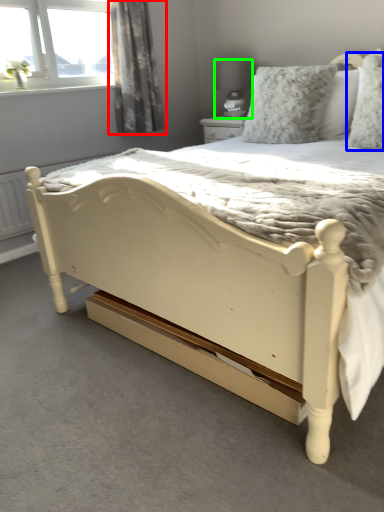
Question: Based on their relative distances, which object is farther from curtain (highlighted by a red box)? Choose from pillow (highlighted by a blue box) and lamp (highlighted by a green box).

Choices:
 (A) pillow
 (B) lamp

Answer: (A)